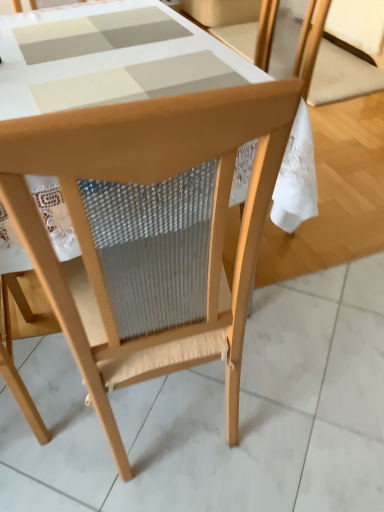
Identify the location of free space to the right of natural wood chair at center, marked as the 2th chair in a top-to-bottom arrangement. (306, 392).